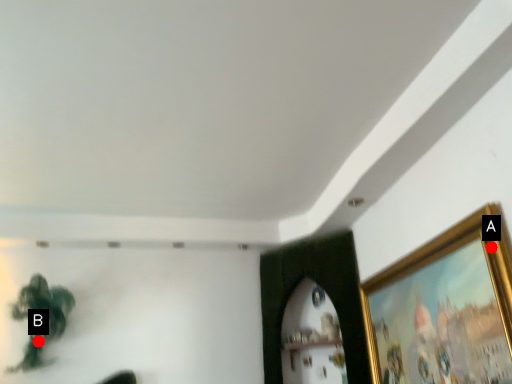
Question: Two points are circled on the image, labeled by A and B beside each circle. Which point is closer to the camera?

Choices:
 (A) A is closer
 (B) B is closer

Answer: (A)